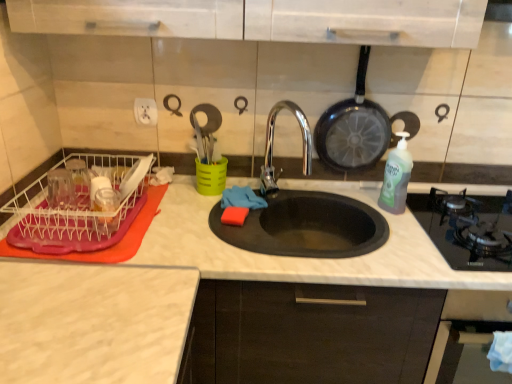
What is the approximate height of black non-stick frying pan at upper right?

18.12 inches.

Describe the element at coordinates (353, 128) in the screenshot. The width and height of the screenshot is (512, 384). I see `black non-stick frying pan at upper right` at that location.

This screenshot has height=384, width=512. I want to click on green translucent bottle at right, so click(x=396, y=177).

The height and width of the screenshot is (384, 512). Describe the element at coordinates (466, 318) in the screenshot. I see `black glass oven at lower right` at that location.

Measure the distance between black glass oven at lower right and camera.

black glass oven at lower right and camera are 1.12 meters apart.

Where is `white marble countertop at center`? white marble countertop at center is located at coordinates (318, 259).

What are the coordinates of `black non-stick frying pan at upper right` in the screenshot? It's located at 353,128.

Does transparent plastic dish rack at left touch black glass oven at lower right?

No.

Is transparent plastic dish rack at left positioned beyond the bounds of black glass oven at lower right?

Yes, transparent plastic dish rack at left is outside of black glass oven at lower right.

Is transparent plastic dish rack at left in front of black glass oven at lower right?

That is False.

This screenshot has height=384, width=512. In order to click on dish washer on the left of black glass oven at lower right in this screenshot , I will do pyautogui.click(x=70, y=219).

Can you confirm if black glass gas stove at right is positioned to the left of black non-stick frying pan at upper right?

No.

Which object is closer to the camera taking this photo, black glass gas stove at right or black non-stick frying pan at upper right?

black glass gas stove at right.

From a real-world perspective, is black glass gas stove at right physically located above or below black non-stick frying pan at upper right?

black glass gas stove at right is below black non-stick frying pan at upper right.

Does black glass gas stove at right have a larger size compared to black non-stick frying pan at upper right?

Indeed, black glass gas stove at right has a larger size compared to black non-stick frying pan at upper right.

Looking at the image, does black non-stick frying pan at upper right seem bigger or smaller compared to transparent plastic dish rack at left?

Clearly, black non-stick frying pan at upper right is smaller in size than transparent plastic dish rack at left.

Is black non-stick frying pan at upper right facing towards transparent plastic dish rack at left?

No, black non-stick frying pan at upper right is not aimed at transparent plastic dish rack at left.

How many degrees apart are the facing directions of black non-stick frying pan at upper right and transparent plastic dish rack at left?

They differ by 0.939 degrees in their facing directions.

Can you confirm if black non-stick frying pan at upper right is positioned to the left of transparent plastic dish rack at left?

Incorrect, black non-stick frying pan at upper right is not on the left side of transparent plastic dish rack at left.

In the image, is transparent plastic dish rack at left positioned in front of or behind black non-stick frying pan at upper right?

transparent plastic dish rack at left is in front of black non-stick frying pan at upper right.

Considering the positions of objects transparent plastic dish rack at left and black non-stick frying pan at upper right in the image provided, who is more to the right, transparent plastic dish rack at left or black non-stick frying pan at upper right?

black non-stick frying pan at upper right.

From their relative heights in the image, would you say transparent plastic dish rack at left is taller or shorter than black non-stick frying pan at upper right?

In the image, transparent plastic dish rack at left appears to be shorter than black non-stick frying pan at upper right.

Who is smaller, transparent plastic dish rack at left or black non-stick frying pan at upper right?

Smaller between the two is black non-stick frying pan at upper right.

In the scene shown: Is black glass gas stove at right turned away from transparent plastic dish rack at left?

No.

Is black glass gas stove at right bigger than transparent plastic dish rack at left?

Correct, black glass gas stove at right is larger in size than transparent plastic dish rack at left.

How many degrees apart are the facing directions of black glass gas stove at right and transparent plastic dish rack at left?

The facing directions of black glass gas stove at right and transparent plastic dish rack at left are 2.1 degrees apart.

Does transparent plastic dish rack at left touch black glass gas stove at right?

No, transparent plastic dish rack at left is not in contact with black glass gas stove at right.

Do you think transparent plastic dish rack at left is within black glass gas stove at right, or outside of it?

transparent plastic dish rack at left lies outside black glass gas stove at right.

Who is bigger, transparent plastic dish rack at left or black glass gas stove at right?

With larger size is black glass gas stove at right.

Is transparent plastic dish rack at left positioned in front of black glass gas stove at right?

That is False.

Does white marble countertop at center lie behind black glass oven at lower right?

Yes, white marble countertop at center is further from the viewer.

How distant is white marble countertop at center from black glass oven at lower right?

white marble countertop at center is 12.08 inches away from black glass oven at lower right.

From a real-world perspective, is white marble countertop at center under black glass oven at lower right?

Yes.

Considering the sizes of objects white marble countertop at center and black glass oven at lower right in the image provided, who is taller, white marble countertop at center or black glass oven at lower right?

white marble countertop at center is taller.

The width and height of the screenshot is (512, 384). Identify the location of oven on the right side of transparent plastic dish rack at left. (466, 318).

Where is `frying pan lying above the black glass gas stove at right (from the image's perspective)`? The image size is (512, 384). frying pan lying above the black glass gas stove at right (from the image's perspective) is located at coordinates (353, 128).

When comparing their distances from transparent plastic dish rack at left, does green translucent bottle at right or black glass gas stove at right seem closer?

The object closer to transparent plastic dish rack at left is green translucent bottle at right.

Considering their positions, is black glass gas stove at right positioned further to green translucent bottle at right than white marble countertop at center?

The object further to green translucent bottle at right is white marble countertop at center.

Considering their positions, is white marble countertop at center positioned further to green translucent bottle at right than black non-stick frying pan at upper right?

Among the two, white marble countertop at center is located further to green translucent bottle at right.

From the image, which object appears to be farther from green translucent bottle at right, black non-stick frying pan at upper right or white marble countertop at center?

white marble countertop at center.

Looking at the image, which one is located further to black glass gas stove at right, black glass oven at lower right or transparent plastic dish rack at left?

transparent plastic dish rack at left is positioned further to the anchor black glass gas stove at right.

Considering their positions, is black glass oven at lower right positioned further to black non-stick frying pan at upper right than black glass gas stove at right?

Based on the image, black glass oven at lower right appears to be further to black non-stick frying pan at upper right.

When comparing their distances from black non-stick frying pan at upper right, does black glass oven at lower right or transparent plastic dish rack at left seem closer?

Based on the image, black glass oven at lower right appears to be nearer to black non-stick frying pan at upper right.

Estimate the real-world distances between objects in this image. Which object is further from black non-stick frying pan at upper right, black glass gas stove at right or black glass oven at lower right?

black glass oven at lower right lies further to black non-stick frying pan at upper right than the other object.

At what (x,y) coordinates should I click in order to perform the action: click on countertop between black glass gas stove at right and black glass oven at lower right vertically. Please return your answer as a coordinate pair (x, y). The height and width of the screenshot is (384, 512). Looking at the image, I should click on (318, 259).

Identify the location of countertop between green translucent bottle at right and black glass oven at lower right from top to bottom. (318, 259).

Where is `bottle that lies between black non-stick frying pan at upper right and black glass oven at lower right from top to bottom`? The image size is (512, 384). bottle that lies between black non-stick frying pan at upper right and black glass oven at lower right from top to bottom is located at coordinates (396, 177).

Where is `frying pan located between transparent plastic dish rack at left and white marble countertop at center in the left-right direction`? The height and width of the screenshot is (384, 512). frying pan located between transparent plastic dish rack at left and white marble countertop at center in the left-right direction is located at coordinates (353, 128).